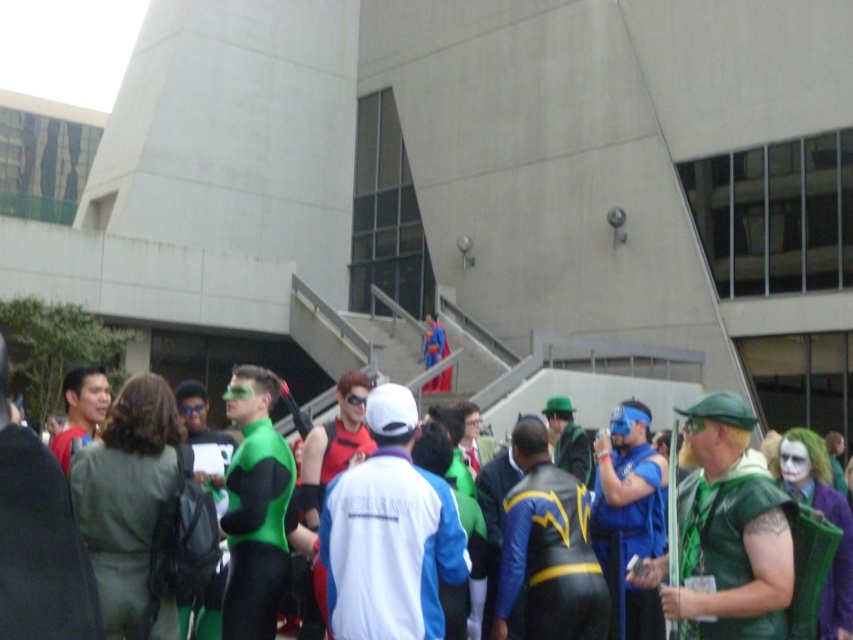
Can you confirm if leather-like blue and yellow suit at center is smaller than shiny blue costume at center?

Yes, leather-like blue and yellow suit at center is smaller than shiny blue costume at center.

Is leather-like blue and yellow suit at center above shiny blue costume at center?

No, leather-like blue and yellow suit at center is not above shiny blue costume at center.

Where is `leather-like blue and yellow suit at center`? This screenshot has height=640, width=853. leather-like blue and yellow suit at center is located at coordinates (550, 557).

Locate an element on the screen. The width and height of the screenshot is (853, 640). leather-like blue and yellow suit at center is located at coordinates (550, 557).

Measure the distance between point (10, 518) and camera.

Point (10, 518) and camera are 18.80 feet apart.

The image size is (853, 640). Identify the location of green spandex suit at center. pyautogui.click(x=39, y=540).

The height and width of the screenshot is (640, 853). What are the coordinates of `green spandex suit at center` in the screenshot? It's located at tap(39, 540).

Is green spandex suit at center positioned in front of leather-like blue and yellow suit at center?

Yes.

Describe the element at coordinates (39, 540) in the screenshot. I see `green spandex suit at center` at that location.

Image resolution: width=853 pixels, height=640 pixels. What are the coordinates of `green spandex suit at center` in the screenshot? It's located at (39, 540).